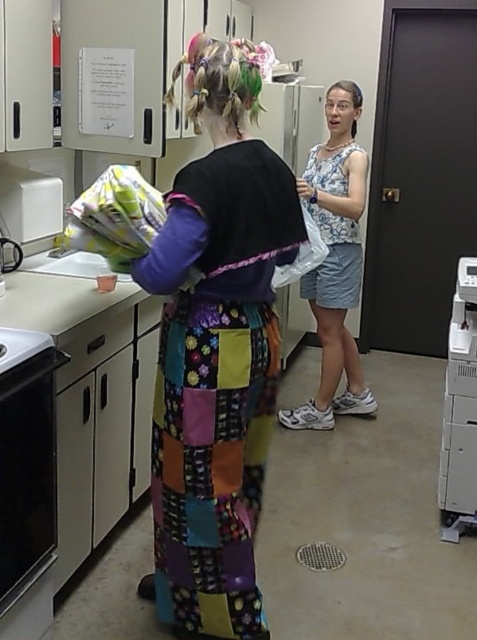
You are trying to reach the white plastic printer at right to print a document. However, there is a black glass oven at lower left in the way. Can you move around the oven to access the printer?

The black glass oven at lower left is positioned under the white plastic printer at right, meaning the oven is below the printer. Since the oven is under the printer, you can likely move around the oven to access the printer as they are vertically aligned.

You are standing in the utility room and want to reach both points mentioned. Which point is closer to you, point (x=352, y=205) or point (x=448, y=380)?

Point (x=352, y=205) is closer to you because it is further to the viewer than point (x=448, y=380).

You need to place a new appliance that is 1.5 meters wide in the utility room. The black glass oven at lower left and the white plastic printer at right are already there. Can you fit the new appliance between them?

The black glass oven at lower left is narrower than the white plastic printer at right. However, since the total available space between them isn not provided, it is impossible to determine if the 1.5 meter wide appliance can fit.